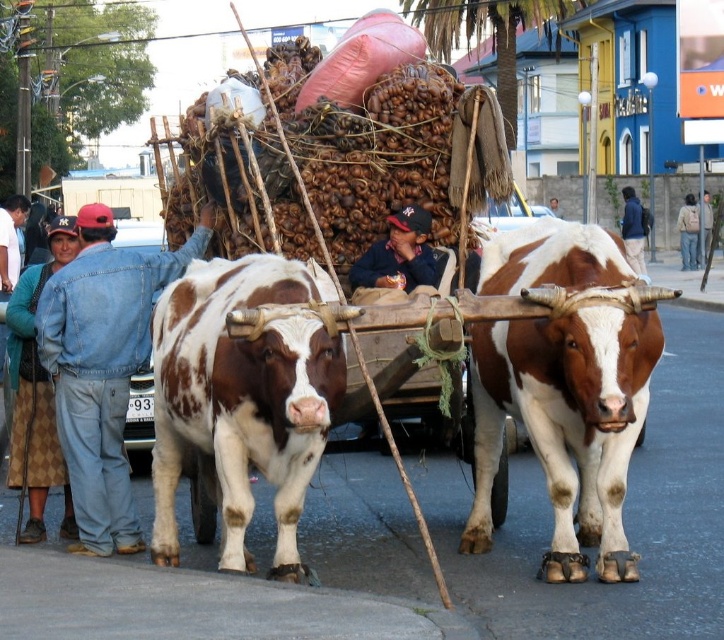
Question: Which object appears farthest from the camera in this image?

Choices:
 (A) brown and white textured bull at center
 (B) denim jacket at left
 (C) blue denim jacket at center
 (D) brown spotted hide at center

Answer: (C)

Question: Can you confirm if brown and white textured bull at center is smaller than brown spotted hide at center?

Choices:
 (A) no
 (B) yes

Answer: (A)

Question: Does brown and white textured bull at center lie behind brown spotted hide at center?

Choices:
 (A) yes
 (B) no

Answer: (A)

Question: Does brown and white textured bull at center have a smaller size compared to brown spotted hide at center?

Choices:
 (A) yes
 (B) no

Answer: (B)

Question: Which point is farther from the camera taking this photo?

Choices:
 (A) (371, 275)
 (B) (615, 316)
 (C) (119, 404)
 (D) (248, 486)

Answer: (A)

Question: Which point is farther from the camera taking this photo?

Choices:
 (A) (613, 540)
 (B) (424, 214)
 (C) (240, 500)

Answer: (B)